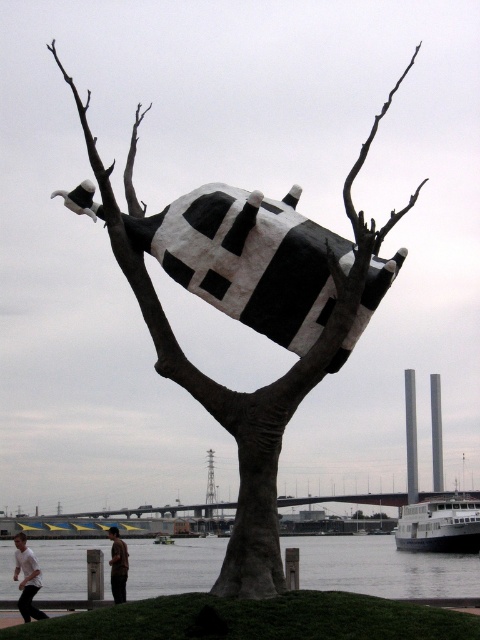
Who is taller, transparent water at lower center or brown cotton shirt at lower center?

transparent water at lower center

This screenshot has width=480, height=640. What do you see at coordinates (382, 566) in the screenshot?
I see `transparent water at lower center` at bounding box center [382, 566].

The image size is (480, 640). Identify the location of transparent water at lower center. pos(382,566).

How far apart are black matte sculpture at center and brown cotton shirt at lower center?

A distance of 38.24 meters exists between black matte sculpture at center and brown cotton shirt at lower center.

Who is higher up, black matte sculpture at center or brown cotton shirt at lower center?

black matte sculpture at center is higher up.

Between point (134, 150) and point (118, 552), which one is positioned in front?

Point (134, 150) is more forward.

Where is `black matte sculpture at center`? black matte sculpture at center is located at coordinates (247, 392).

Is black and white painted sculpture at center above brown cotton shirt at lower center?

Yes, black and white painted sculpture at center is above brown cotton shirt at lower center.

Is black and white painted sculpture at center to the left of brown cotton shirt at lower center from the viewer's perspective?

In fact, black and white painted sculpture at center is to the right of brown cotton shirt at lower center.

Is point (213, 291) behind point (119, 545)?

No, it is in front of (119, 545).

Where is `black and white painted sculpture at center`? The width and height of the screenshot is (480, 640). black and white painted sculpture at center is located at coordinates (248, 259).